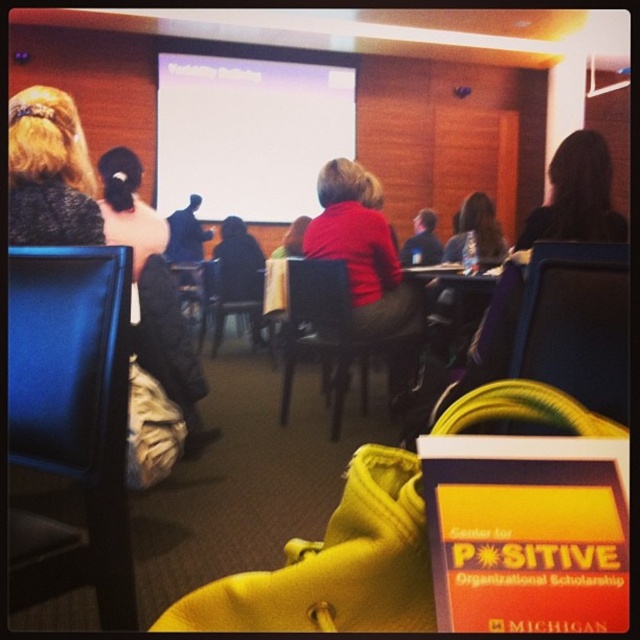
Consider the image. You are an attendee in the conference room and want to see the white matte projection screen at upper center clearly. Is the blue leather chair at left blocking your view?

The blue leather chair at left has a lesser height compared to white matte projection screen at upper center, so it may not fully block your view of the screen.

You are standing in the conference room and want to determine which of the two points, point (58, 282) or point (56, 173), is closer to you. Based on the scene description, which point is nearer?

Point (58, 282) is closer to the viewer than point (56, 173).

You are an attendee in the conference room and need to move from your current position to the white matte projection screen at upper center to adjust the slide. Your blue leather chair at left is where you are sitting. Can you reach the screen without moving your chair?

The blue leather chair at left is 5.66 meters away from the white matte projection screen at upper center, so you would need to leave your chair to reach the screen, as it is too far to adjust from your seated position.